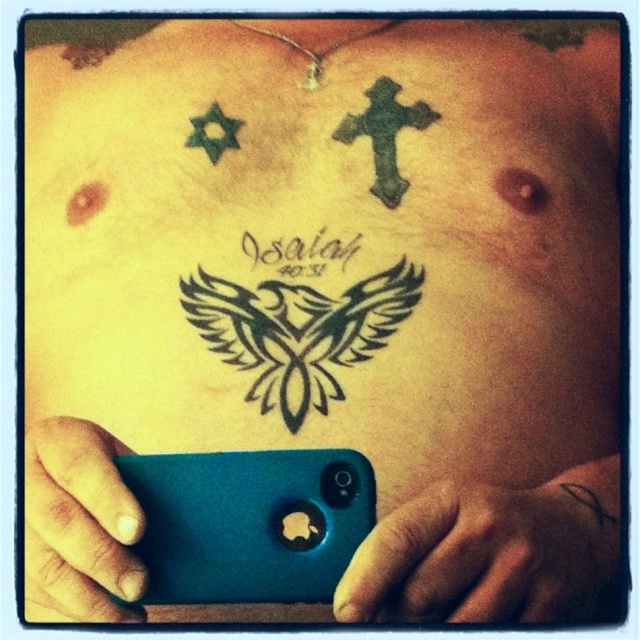
Question: Which of the following is the farthest from the observer?

Choices:
 (A) (211, 150)
 (B) (314, 541)
 (C) (312, 246)

Answer: (A)

Question: Can you confirm if black ink tattoo at center is bigger than green ink star at upper left?

Choices:
 (A) no
 (B) yes

Answer: (B)

Question: Which object is positioned farthest from the metallic apple logo at lower center?

Choices:
 (A) teal matte phone at lower center
 (B) green ink star at upper left
 (C) black ink cross at upper center
 (D) black ink tattoo at center

Answer: (B)

Question: Is metallic apple logo at lower center below green ink star at upper left?

Choices:
 (A) yes
 (B) no

Answer: (A)

Question: Which of these objects is positioned farthest from the black ink cross at upper center?

Choices:
 (A) green ink star at upper left
 (B) metallic apple logo at lower center
 (C) black ink tattoo at center
 (D) teal matte phone at lower center

Answer: (A)

Question: Does teal matte phone at lower center lie in front of metallic apple logo at lower center?

Choices:
 (A) no
 (B) yes

Answer: (B)